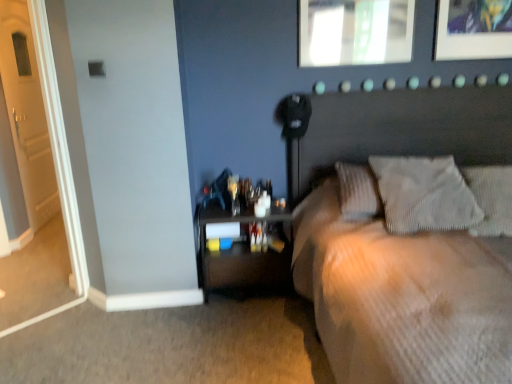
Question: Is white wooden door at left bigger or smaller than textured gray pillow at upper right, marked as the 1th pillow in a right-to-left arrangement?

Choices:
 (A) big
 (B) small

Answer: (A)

Question: Is point (61, 185) closer or farther from the camera than point (502, 173)?

Choices:
 (A) closer
 (B) farther

Answer: (B)

Question: Which object is positioned farthest from the white wooden door at left?

Choices:
 (A) textured gray pillow at upper right, marked as the 1th pillow in a right-to-left arrangement
 (B) matte glass picture frame at upper center
 (C) wooden nightstand at lower left
 (D) white textured pillow at upper right, placed as the first pillow when sorted from left to right
 (E) beige textured bed at center

Answer: (A)

Question: Which is farther from the white textured pillow at upper right, which appears as the second pillow when viewed from the right?

Choices:
 (A) white wooden door at left
 (B) wooden nightstand at lower left
 (C) matte glass picture frame at upper center
 (D) textured gray pillow at upper right, marked as the 1th pillow in a right-to-left arrangement
 (E) beige textured bed at center

Answer: (A)